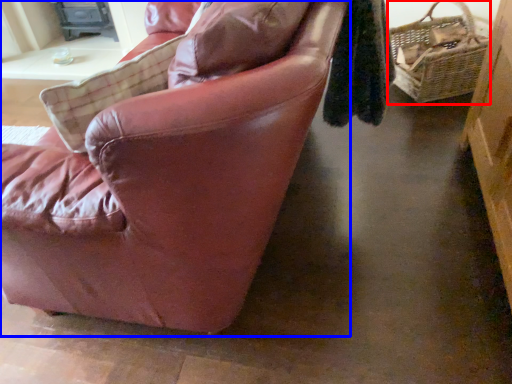
Question: Which object appears farthest to the camera in this image, picnic basket (highlighted by a red box) or chair (highlighted by a blue box)?

Choices:
 (A) picnic basket
 (B) chair

Answer: (A)